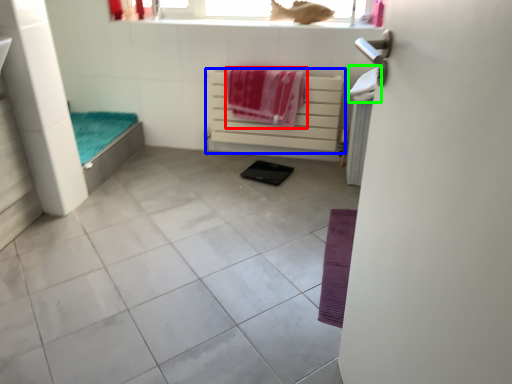
Question: Which object is the closest to the beach towel (highlighted by a red box)? Choose among these: balustrade (highlighted by a blue box) or beach towel (highlighted by a green box).

Choices:
 (A) balustrade
 (B) beach towel

Answer: (A)